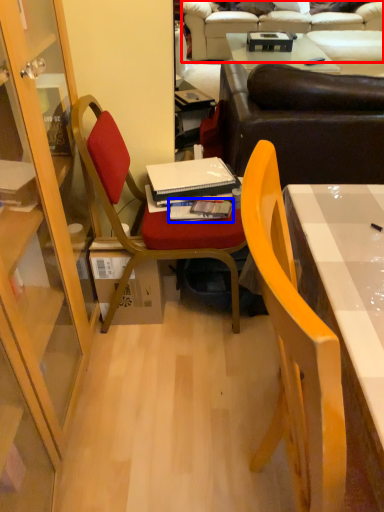
Question: Which of the following is the farthest to the observer, studio couch (highlighted by a red box) or book (highlighted by a blue box)?

Choices:
 (A) studio couch
 (B) book

Answer: (A)